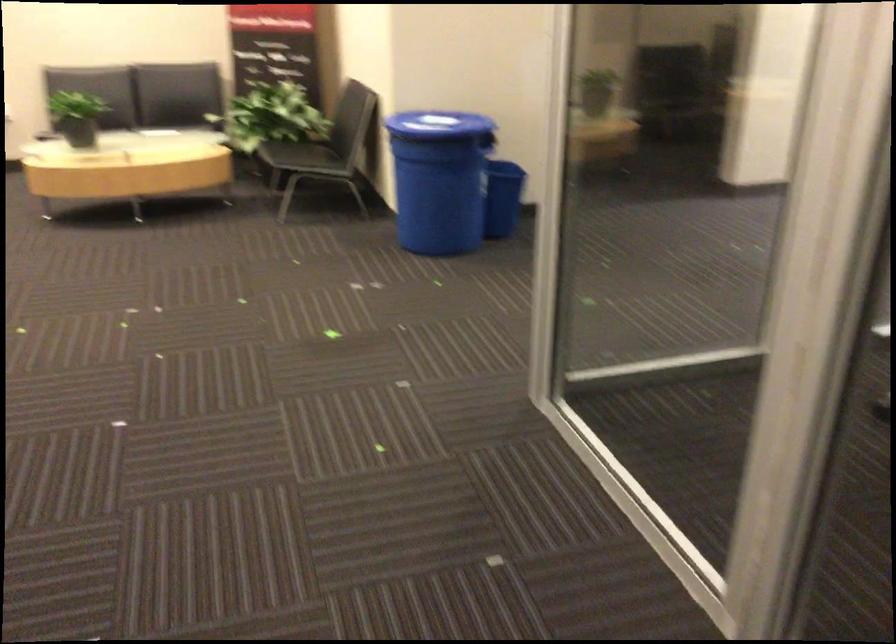
What do you see at coordinates (438, 124) in the screenshot?
I see `the blue trash can lid` at bounding box center [438, 124].